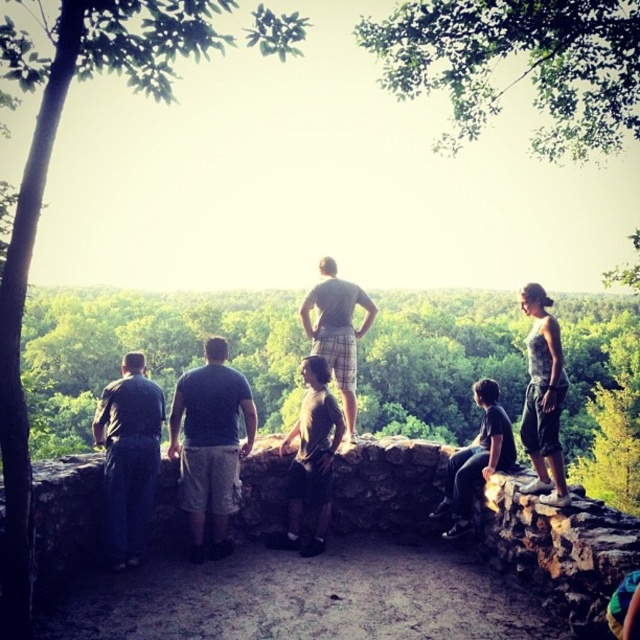
Which is below, dark gray cotton shirt at center or dark blue jeans at left?

Positioned lower is dark blue jeans at left.

Is dark gray cotton shirt at center positioned before dark blue jeans at left?

No.

At what (x,y) coordinates should I click in order to perform the action: click on dark gray cotton shirt at center. Please return your answer as a coordinate pair (x, y). The width and height of the screenshot is (640, 640). Looking at the image, I should click on (211, 444).

Locate an element on the screen. This screenshot has height=640, width=640. dark gray cotton shirt at center is located at coordinates (211, 444).

Does dark gray cotton shirt at center have a greater width compared to dark gray shirt at lower right?

No, dark gray cotton shirt at center is not wider than dark gray shirt at lower right.

Is dark gray cotton shirt at center bigger than dark gray shirt at lower right?

Incorrect, dark gray cotton shirt at center is not larger than dark gray shirt at lower right.

Where is `dark gray cotton shirt at center`? dark gray cotton shirt at center is located at coordinates (211, 444).

Does dark blue jeans at left have a greater height compared to printed cotton tank top at right?

Incorrect, dark blue jeans at left's height is not larger of printed cotton tank top at right's.

Does point (134, 442) come farther from viewer compared to point (520, 426)?

No, (134, 442) is closer to viewer.

Find the location of a particular element. This screenshot has height=640, width=640. dark blue jeans at left is located at coordinates (129, 456).

Where is `dark blue jeans at left`? dark blue jeans at left is located at coordinates (129, 456).